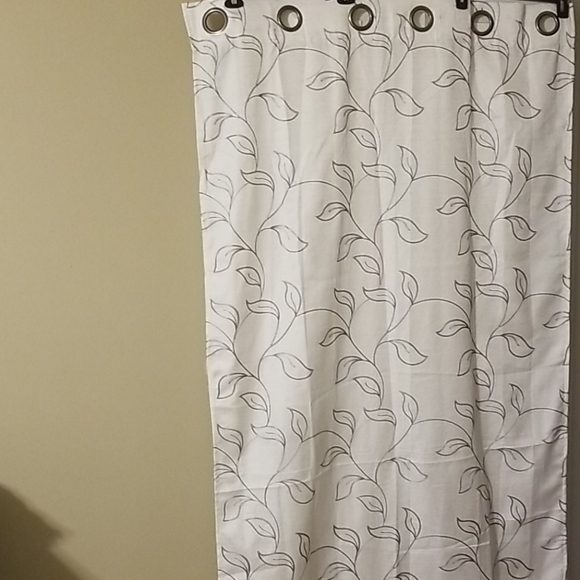
Find the location of `the right side of curtain`. the right side of curtain is located at coordinates click(x=566, y=405).